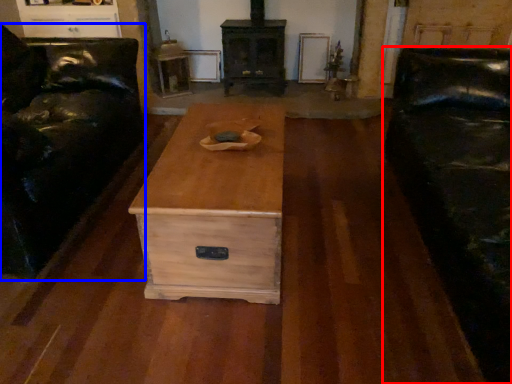
Question: Which point is further to the camera, studio couch (highlighted by a red box) or furniture (highlighted by a blue box)?

Choices:
 (A) studio couch
 (B) furniture

Answer: (B)